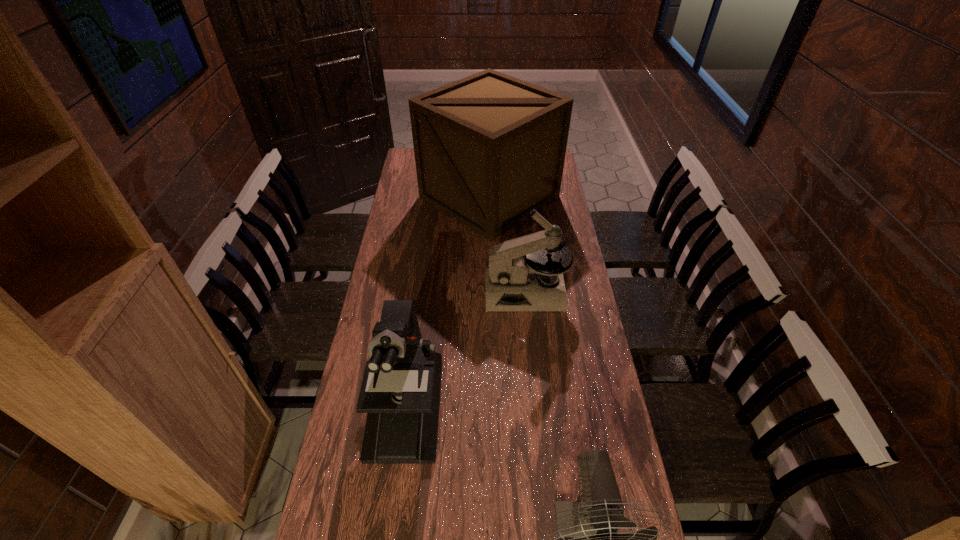
Where is `the farthest object`? Image resolution: width=960 pixels, height=540 pixels. the farthest object is located at coordinates (488, 148).

This screenshot has width=960, height=540. I want to click on the nearer microscope, so click(x=400, y=392).

In order to click on the third farthest object in this screenshot , I will do `click(400, 392)`.

You are a GUI agent. You are given a task and a screenshot of the screen. Output one action in this format:
    pyautogui.click(x=<x>, y=<y>)
    Task: Click on the third nearest object
    
    Given the screenshot: What is the action you would take?
    pyautogui.click(x=512, y=280)

The width and height of the screenshot is (960, 540). Find the location of `the right microscope`. the right microscope is located at coordinates (512, 280).

Locate an element on the screen. The width and height of the screenshot is (960, 540). vacant area situated on the front of the farthest object is located at coordinates (492, 295).

Locate an element on the screen. The image size is (960, 540). vacant space located 0.140m through the eyepieces of the third farthest object is located at coordinates (390, 521).

Identify the location of blank space located at the eyepiece of the farther microscope. Image resolution: width=960 pixels, height=540 pixels. (459, 291).

Locate an element on the screen. free space located at the eyepiece of the farther microscope is located at coordinates (456, 291).

I want to click on free space located at the eyepiece of the farther microscope, so coord(421,291).